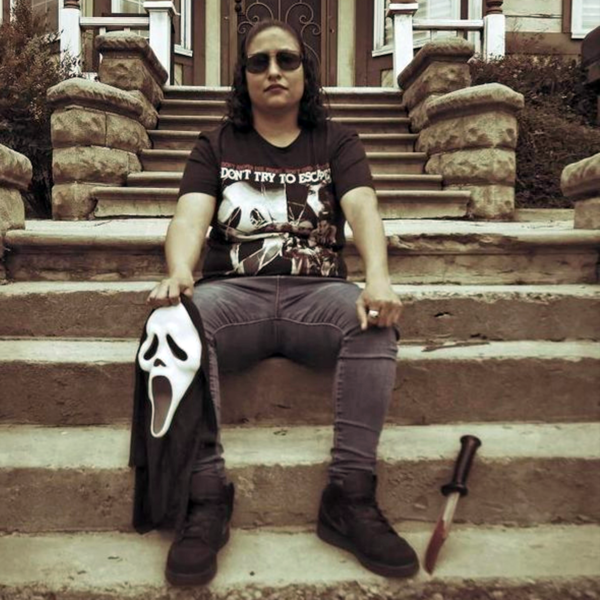
I want to click on door, so click(x=329, y=37).